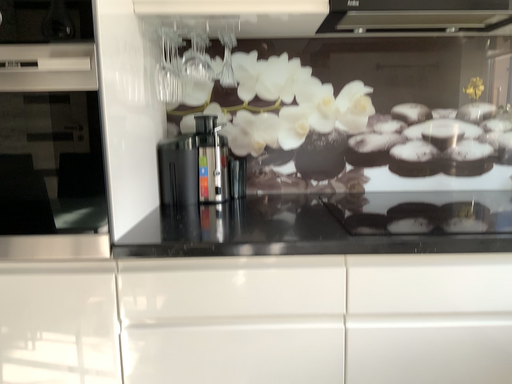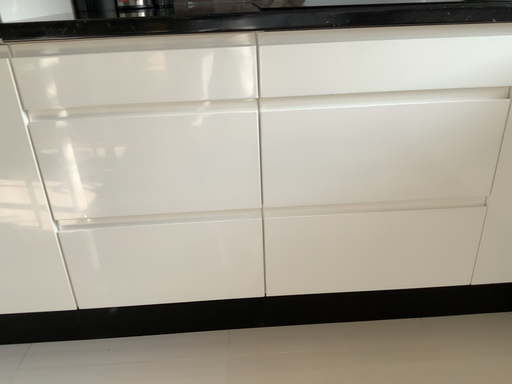
Question: How did the camera likely rotate when shooting the video?

Choices:
 (A) rotated upward
 (B) rotated downward

Answer: (B)